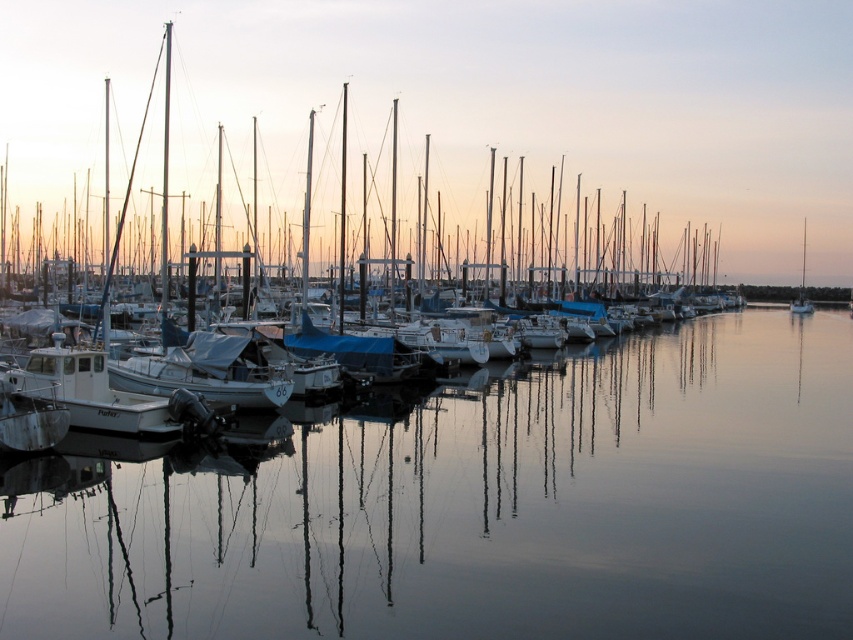
In the scene shown: You are standing at the edge of the marina, looking out at the scene. There is a point marked at coordinates (480, 506). What is located at that point?

The point at coordinates (480, 506) is occupied by clear water at center.